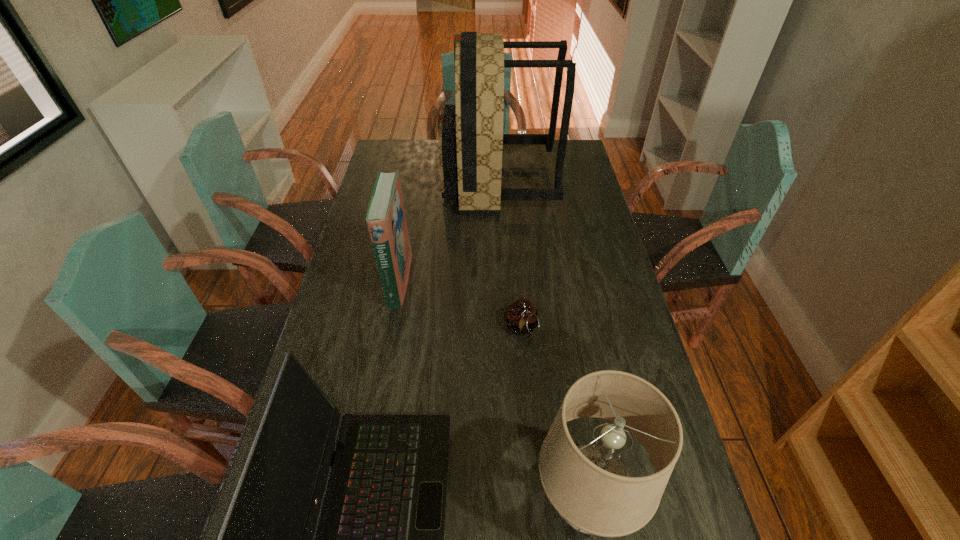
Find the location of `object at the far edge`. object at the far edge is located at coordinates (471, 139).

At what (x,y) coordinates should I click in order to perform the action: click on object present at the left edge. Please return your answer as a coordinate pair (x, y). The image size is (960, 540). Looking at the image, I should click on (386, 220).

The height and width of the screenshot is (540, 960). What are the coordinates of `object present at the right edge` in the screenshot? It's located at [x=471, y=139].

Locate an element on the screen. The width and height of the screenshot is (960, 540). object present at the far right corner is located at coordinates (471, 139).

The height and width of the screenshot is (540, 960). I want to click on vacant space at the far edge of the desktop, so click(436, 156).

At what (x,y) coordinates should I click in order to perform the action: click on vacant point at the left edge. Please return your answer as a coordinate pair (x, y). This screenshot has width=960, height=540. Looking at the image, I should click on (390, 172).

Locate an element on the screen. The height and width of the screenshot is (540, 960). free space at the right edge of the desktop is located at coordinates (571, 174).

What are the coordinates of `free space at the far right corner of the desktop` in the screenshot? It's located at [x=576, y=163].

The height and width of the screenshot is (540, 960). What are the coordinates of `unoccupied area between the shortest object and the hardback book` in the screenshot? It's located at (460, 304).

This screenshot has width=960, height=540. I want to click on blank region between the shortest object and the hardback book, so click(x=460, y=304).